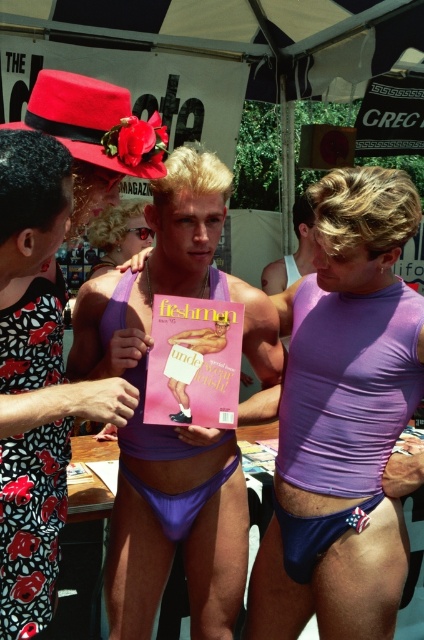
Question: Among these objects, which one is farthest from the camera?

Choices:
 (A) pink matte magazine at center
 (B) purple matte bikini top at center
 (C) matte red hat at upper left

Answer: (C)

Question: Can you confirm if blonde hair wig at center is positioned to the left of purple fabric bikini bottom at center?

Choices:
 (A) yes
 (B) no

Answer: (A)

Question: Is purple matte bikini top at center smaller than blue satin thong at lower center?

Choices:
 (A) no
 (B) yes

Answer: (A)

Question: Which point is closer to the camera?

Choices:
 (A) (225, 330)
 (B) (164, 520)
 (C) (175, 12)
 (D) (16, 598)

Answer: (D)

Question: Estimate the real-world distances between objects in this image. Which object is farther from the purple matte underwear at center?

Choices:
 (A) matte purple bikini bottom at center
 (B) blonde hair wig at center
 (C) blue satin thong at lower center

Answer: (B)

Question: Can you confirm if matte purple bikini bottom at center is positioned above purple matte bikini top at center?

Choices:
 (A) yes
 (B) no

Answer: (B)